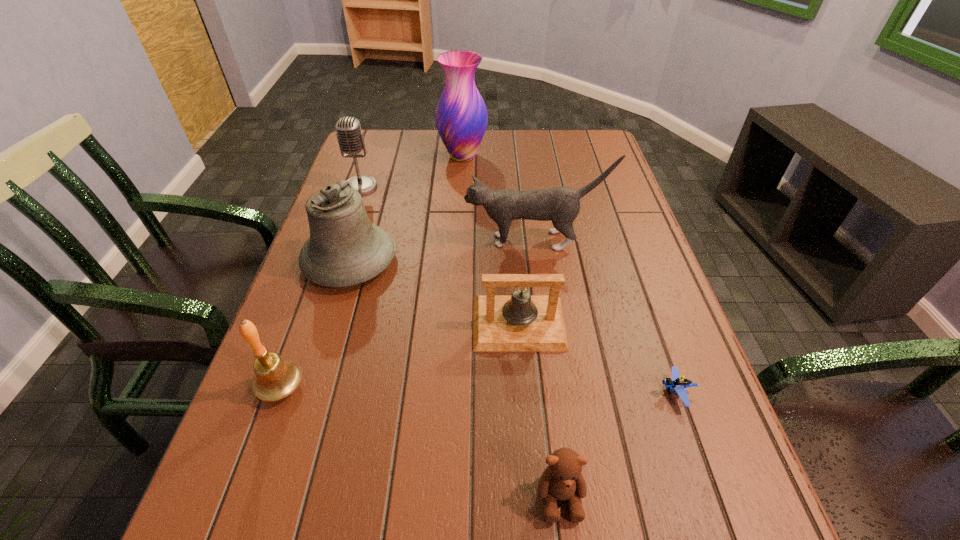
Identify which bell is located as the second nearest to the nearest bell. Please provide its 2D coordinates. Your answer should be formatted as a tuple, i.e. [(x, y)], where the tuple contains the x and y coordinates of a point satisfying the conditions above.

[(520, 322)]

The width and height of the screenshot is (960, 540). I want to click on bell that is the closest to the farthest bell, so click(520, 322).

Image resolution: width=960 pixels, height=540 pixels. I want to click on free space that satisfies the following two spatial constraints: 1. on the back side of the vase; 2. on the left side of the seventh nearest object, so click(372, 156).

Where is `vacant point that satisfies the following two spatial constraints: 1. at the face of the cat; 2. on the front side of the shortest bell`? This screenshot has width=960, height=540. vacant point that satisfies the following two spatial constraints: 1. at the face of the cat; 2. on the front side of the shortest bell is located at coordinates (546, 323).